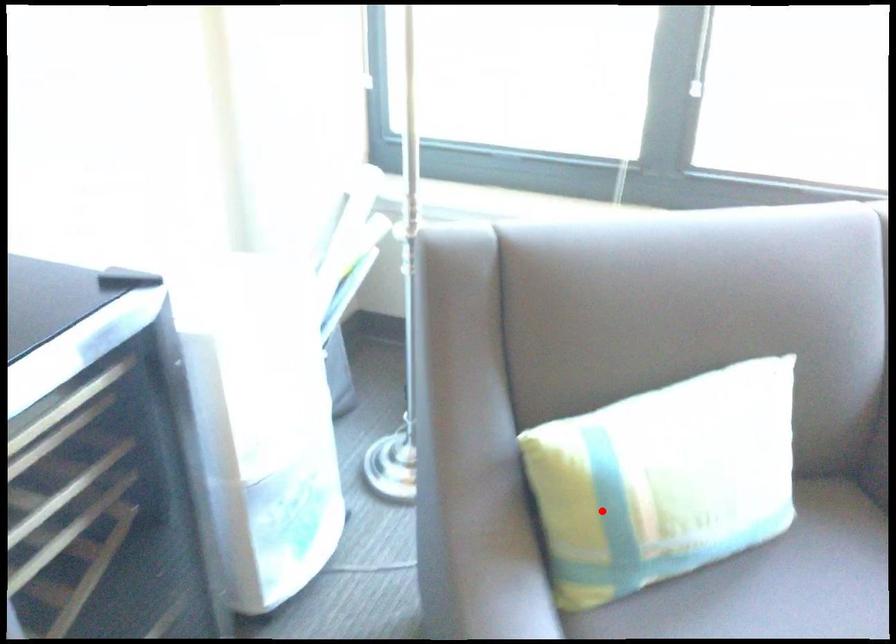
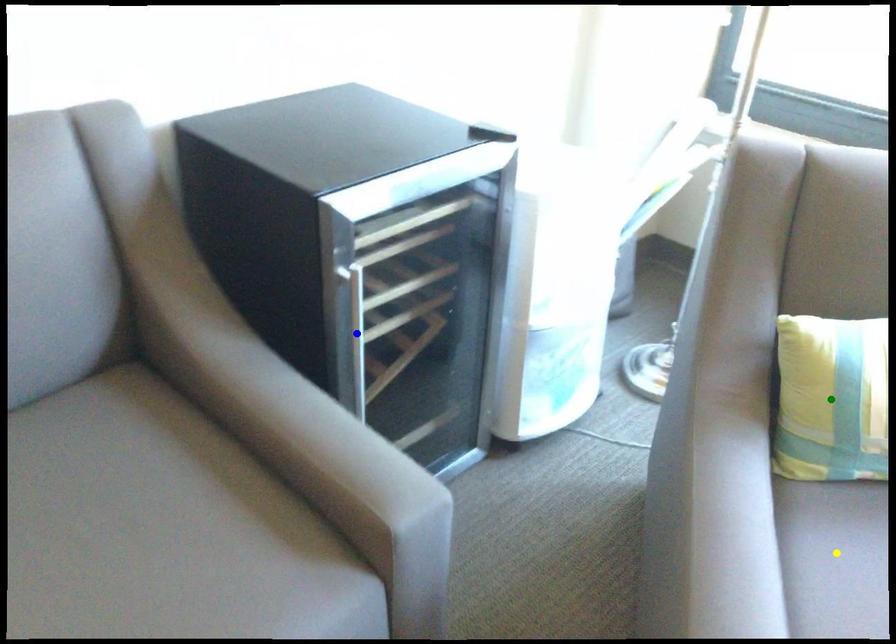
Question: I am providing you with two images of the same scene from different viewpoints. A red point is marked on the first image. You are given multiple points on the second image. Which point in image 2 is actually the same real-world point as the red point in image 1?

Choices:
 (A) green point
 (B) blue point
 (C) yellow point

Answer: (A)